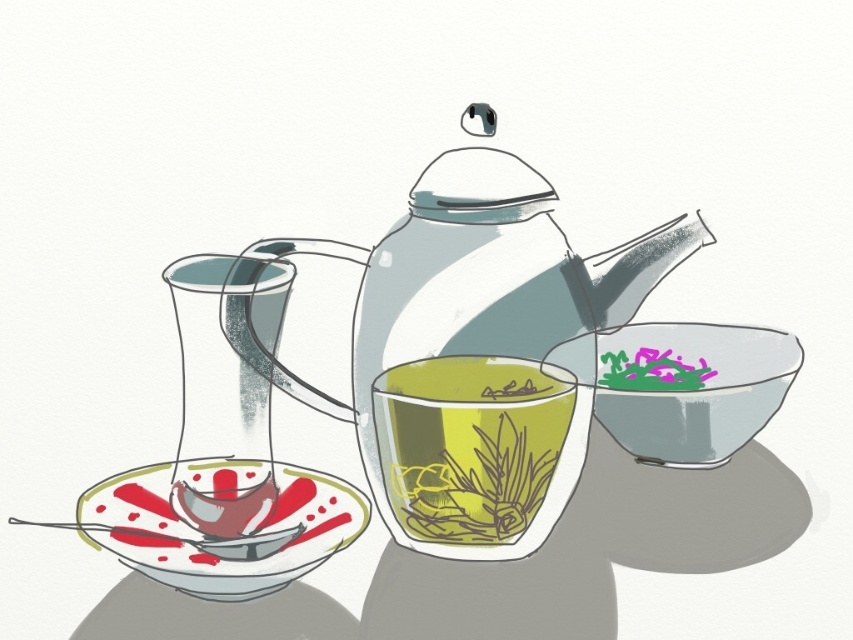
Question: Does transparent glass teacup at center come in front of matte glass saucer at lower left?

Choices:
 (A) no
 (B) yes

Answer: (A)

Question: Is transparent glass teacup at center thinner than transparent glass bowl at center right?

Choices:
 (A) no
 (B) yes

Answer: (B)

Question: Which point is farther to the camera?

Choices:
 (A) (231, 580)
 (B) (567, 388)
 (C) (566, 387)

Answer: (C)

Question: Is transparent glass teacup at center positioned in front of matte glass saucer at lower left?

Choices:
 (A) yes
 (B) no

Answer: (B)

Question: Among these points, which one is nearest to the camera?

Choices:
 (A) (553, 346)
 (B) (288, 497)
 (C) (465, 451)
 (D) (543, 445)

Answer: (C)

Question: Considering the real-world distances, which object is closest to the matte glass saucer at lower left?

Choices:
 (A) transparent glass teacup at center
 (B) translucent glass teapot at center
 (C) transparent glass bowl at center right

Answer: (A)